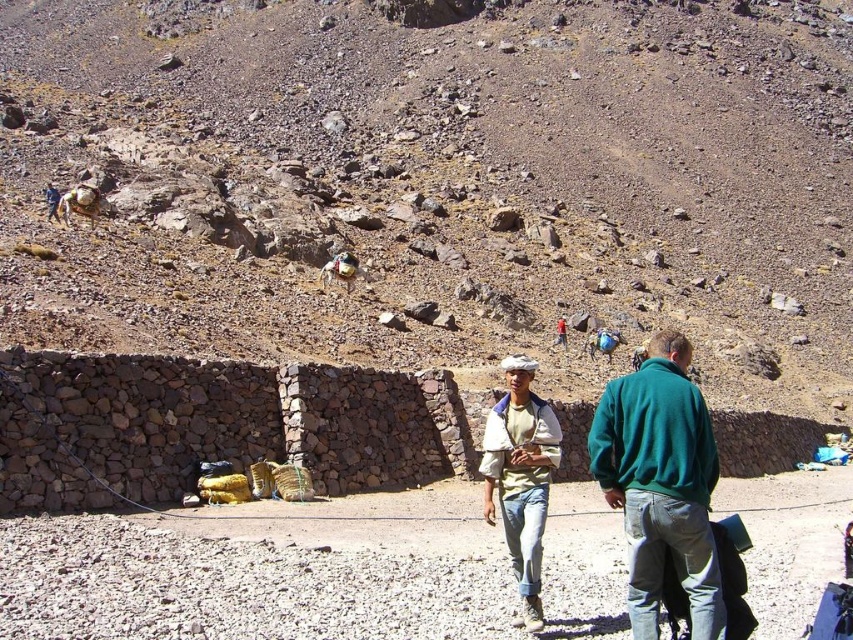
Does green fleece jacket at lower right lie behind light beige cotton shirt at center?

No, green fleece jacket at lower right is in front of light beige cotton shirt at center.

Does green fleece jacket at lower right appear on the left side of light beige cotton shirt at center?

No, green fleece jacket at lower right is not to the left of light beige cotton shirt at center.

Between point (692, 580) and point (514, 518), which one is positioned behind?

Positioned behind is point (514, 518).

Locate an element on the screen. This screenshot has width=853, height=640. green fleece jacket at lower right is located at coordinates (660, 483).

Does light beige cotton shirt at center appear over brown fuzzy donkey at center?

Actually, light beige cotton shirt at center is below brown fuzzy donkey at center.

Does light beige cotton shirt at center have a lesser width compared to brown fuzzy donkey at center?

In fact, light beige cotton shirt at center might be wider than brown fuzzy donkey at center.

Who is more distant from viewer, (x=521, y=563) or (x=349, y=289)?

The point (x=349, y=289) is more distant.

Locate an element on the screen. The height and width of the screenshot is (640, 853). light beige cotton shirt at center is located at coordinates coord(520,476).

Does point (625, 525) come behind point (323, 284)?

That is False.

The height and width of the screenshot is (640, 853). I want to click on green fleece jacket at lower right, so click(x=660, y=483).

At what (x,y) coordinates should I click in order to perform the action: click on green fleece jacket at lower right. Please return your answer as a coordinate pair (x, y). The width and height of the screenshot is (853, 640). Looking at the image, I should click on [x=660, y=483].